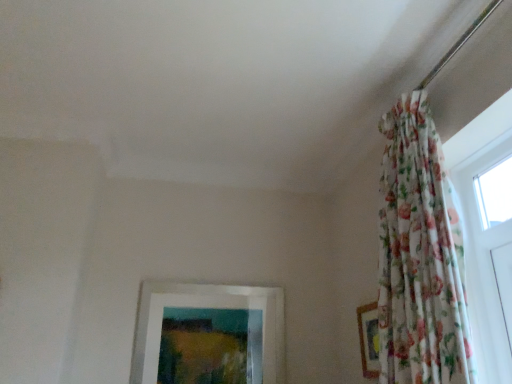
Question: Is floral fabric picture frame at right, the second picture frame positioned from the back, to the right of white matte picture frame at lower center, the 1th picture frame when ordered from left to right, from the viewer's perspective?

Choices:
 (A) no
 (B) yes

Answer: (B)

Question: Is floral fabric picture frame at right, which ranks as the 2th picture frame in left-to-right order, positioned before white matte picture frame at lower center, acting as the 2th picture frame starting from the right?

Choices:
 (A) yes
 (B) no

Answer: (A)

Question: Considering the relative positions of floral fabric picture frame at right, positioned as the 1th picture frame in right-to-left order, and white matte picture frame at lower center, the 1th picture frame when ordered from back to front, in the image provided, is floral fabric picture frame at right, positioned as the 1th picture frame in right-to-left order, behind white matte picture frame at lower center, the 1th picture frame when ordered from back to front,?

Choices:
 (A) yes
 (B) no

Answer: (B)

Question: Does floral fabric picture frame at right, which ranks as the 2th picture frame in left-to-right order, have a lesser width compared to white matte picture frame at lower center, the 1th picture frame when ordered from back to front?

Choices:
 (A) yes
 (B) no

Answer: (A)

Question: Is floral fabric picture frame at right, the second picture frame positioned from the back, oriented away from white matte picture frame at lower center, acting as the 2th picture frame starting from the right?

Choices:
 (A) yes
 (B) no

Answer: (B)

Question: Would you say floral fabric curtain at upper right is inside or outside floral fabric picture frame at right, positioned as the 1th picture frame in right-to-left order?

Choices:
 (A) inside
 (B) outside

Answer: (B)

Question: Looking at their shapes, would you say floral fabric curtain at upper right is wider or thinner than floral fabric picture frame at right, the second picture frame positioned from the back?

Choices:
 (A) wide
 (B) thin

Answer: (A)

Question: From the image's perspective, is floral fabric curtain at upper right above or below floral fabric picture frame at right, the second picture frame positioned from the back?

Choices:
 (A) below
 (B) above

Answer: (B)

Question: Relative to floral fabric picture frame at right, which ranks as the 2th picture frame in left-to-right order, is floral fabric curtain at upper right in front or behind?

Choices:
 (A) behind
 (B) front

Answer: (B)

Question: Considering the positions of white matte picture frame at lower center, the 2th picture frame when ordered from front to back, and floral fabric picture frame at right, placed as the 1th picture frame when sorted from front to back, in the image, is white matte picture frame at lower center, the 2th picture frame when ordered from front to back, bigger or smaller than floral fabric picture frame at right, placed as the 1th picture frame when sorted from front to back,?

Choices:
 (A) big
 (B) small

Answer: (A)

Question: Visually, is white matte picture frame at lower center, acting as the 2th picture frame starting from the right, positioned to the left or to the right of floral fabric picture frame at right, the second picture frame positioned from the back?

Choices:
 (A) right
 (B) left

Answer: (B)

Question: Is white matte picture frame at lower center, the 1th picture frame when ordered from back to front, taller or shorter than floral fabric picture frame at right, positioned as the 1th picture frame in right-to-left order?

Choices:
 (A) short
 (B) tall

Answer: (B)

Question: Choose the correct answer: Is white matte picture frame at lower center, acting as the 2th picture frame starting from the right, inside floral fabric picture frame at right, placed as the 1th picture frame when sorted from front to back, or outside it?

Choices:
 (A) outside
 (B) inside

Answer: (A)

Question: Is floral fabric picture frame at right, which ranks as the 2th picture frame in left-to-right order, bigger or smaller than white matte picture frame at lower center, acting as the 2th picture frame starting from the right?

Choices:
 (A) small
 (B) big

Answer: (A)

Question: Considering the relative positions of floral fabric picture frame at right, positioned as the 1th picture frame in right-to-left order, and white matte picture frame at lower center, the 1th picture frame when ordered from left to right, in the image provided, is floral fabric picture frame at right, positioned as the 1th picture frame in right-to-left order, to the left or to the right of white matte picture frame at lower center, the 1th picture frame when ordered from left to right,?

Choices:
 (A) right
 (B) left

Answer: (A)